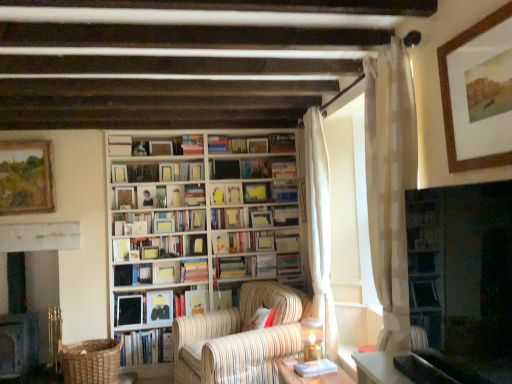
Question: Does hardcover book at center, the 12th book when ordered from bottom to top, have a larger size compared to hardcover books at center, acting as the seventh book starting from the bottom?

Choices:
 (A) yes
 (B) no

Answer: (B)

Question: Is hardcover book at center, the 12th book when ordered from bottom to top, wider than hardcover books at center, arranged as the 11th book when viewed from the top?

Choices:
 (A) no
 (B) yes

Answer: (A)

Question: Would you consider hardcover book at center, the 12th book when ordered from bottom to top, to be distant from hardcover books at center, arranged as the 11th book when viewed from the top?

Choices:
 (A) no
 (B) yes

Answer: (A)

Question: Is hardcover book at center, the 12th book when ordered from bottom to top, shorter than hardcover books at center, arranged as the 11th book when viewed from the top?

Choices:
 (A) yes
 (B) no

Answer: (A)

Question: Is hardcover book at center, the 6th book from the top, in front of hardcover books at center, arranged as the 11th book when viewed from the top?

Choices:
 (A) no
 (B) yes

Answer: (A)

Question: Visually, is matte black book at center, placed as the 13th book when sorted from top to bottom, positioned to the left or to the right of hardcover book at center, which ranks as the 4th book in top-to-bottom order?

Choices:
 (A) left
 (B) right

Answer: (A)

Question: Does point (140, 324) appear closer or farther from the camera than point (282, 180)?

Choices:
 (A) closer
 (B) farther

Answer: (A)

Question: Is matte black book at center, placed as the 13th book when sorted from top to bottom, taller or shorter than hardcover book at center, which ranks as the 4th book in top-to-bottom order?

Choices:
 (A) tall
 (B) short

Answer: (A)

Question: Considering the positions of matte black book at center, placed as the 13th book when sorted from top to bottom, and hardcover book at center, the fourteenth book positioned from the bottom, in the image, is matte black book at center, placed as the 13th book when sorted from top to bottom, bigger or smaller than hardcover book at center, the fourteenth book positioned from the bottom,?

Choices:
 (A) big
 (B) small

Answer: (A)

Question: In terms of size, does matte black book at center, acting as the fifth book starting from the bottom, appear bigger or smaller than wooden framed painting at upper right, the second picture frame positioned from the left?

Choices:
 (A) big
 (B) small

Answer: (A)

Question: From a real-world perspective, is matte black book at center, acting as the fifth book starting from the bottom, physically located above or below wooden framed painting at upper right, the 1th picture frame when ordered from right to left?

Choices:
 (A) above
 (B) below

Answer: (B)

Question: Considering the positions of matte black book at center, acting as the fifth book starting from the bottom, and wooden framed painting at upper right, the first picture frame viewed from the front, in the image, is matte black book at center, acting as the fifth book starting from the bottom, wider or thinner than wooden framed painting at upper right, the first picture frame viewed from the front,?

Choices:
 (A) thin
 (B) wide

Answer: (B)

Question: Is point (147, 322) positioned closer to the camera than point (497, 23)?

Choices:
 (A) farther
 (B) closer

Answer: (A)

Question: From a real-world perspective, is white paper book at center, which is counted as the 8th book, starting from the top, above or below matte black book at center, acting as the fifth book starting from the bottom?

Choices:
 (A) above
 (B) below

Answer: (A)

Question: Looking at the image, does white paper book at center, which is counted as the 8th book, starting from the top, seem bigger or smaller compared to matte black book at center, acting as the fifth book starting from the bottom?

Choices:
 (A) big
 (B) small

Answer: (B)